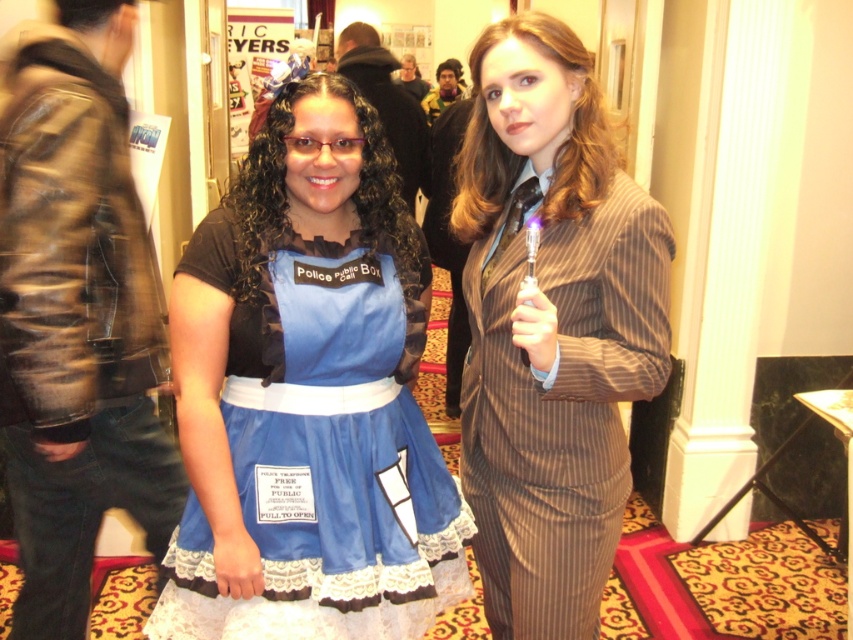
Between leather jacket at left and matte black dress at center, which one appears on the right side from the viewer's perspective?

Positioned to the right is matte black dress at center.

Does leather jacket at left appear under matte black dress at center?

Yes.

This screenshot has height=640, width=853. What are the coordinates of `leather jacket at left` in the screenshot? It's located at (76, 316).

You are a GUI agent. You are given a task and a screenshot of the screen. Output one action in this format:
    pyautogui.click(x=<x>, y=<y>)
    Task: Click on the leather jacket at left
    Image resolution: width=853 pixels, height=640 pixels.
    Given the screenshot: What is the action you would take?
    (x=76, y=316)

Can you confirm if black leather jacket at upper center is smaller than matte black dress at center?

No, black leather jacket at upper center is not smaller than matte black dress at center.

Locate an element on the screen. This screenshot has width=853, height=640. black leather jacket at upper center is located at coordinates (387, 102).

Is point (380, 88) more distant than point (445, 93)?

That is False.

Locate an element on the screen. The image size is (853, 640). black leather jacket at upper center is located at coordinates (387, 102).

Is blue satin dress at center smaller than matte black dress at center?

Yes.

Who is more distant from viewer, (392,282) or (460,90)?

Point (460,90)

At what (x,y) coordinates should I click in order to perform the action: click on blue satin dress at center. Please return your answer as a coordinate pair (x, y). This screenshot has width=853, height=640. Looking at the image, I should click on tap(321, 451).